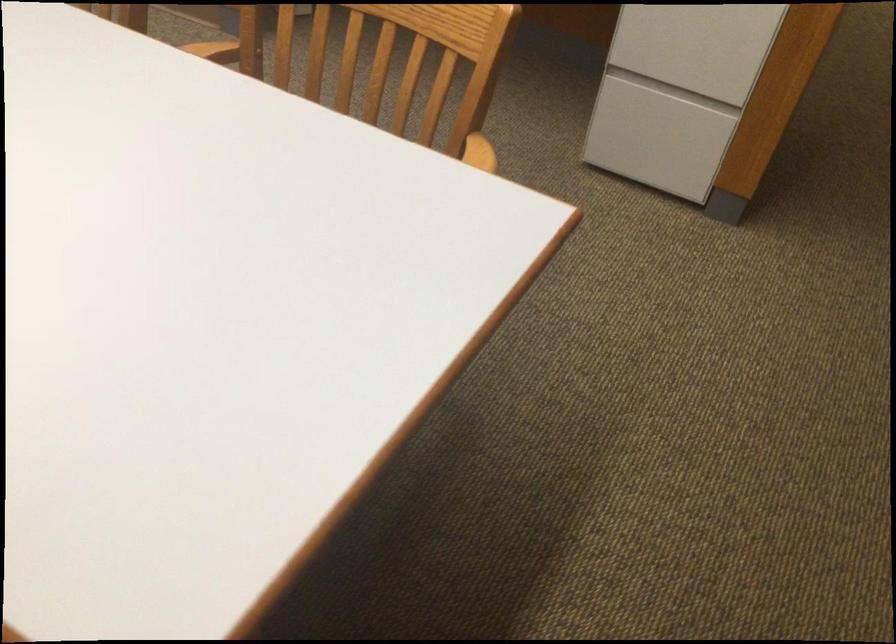
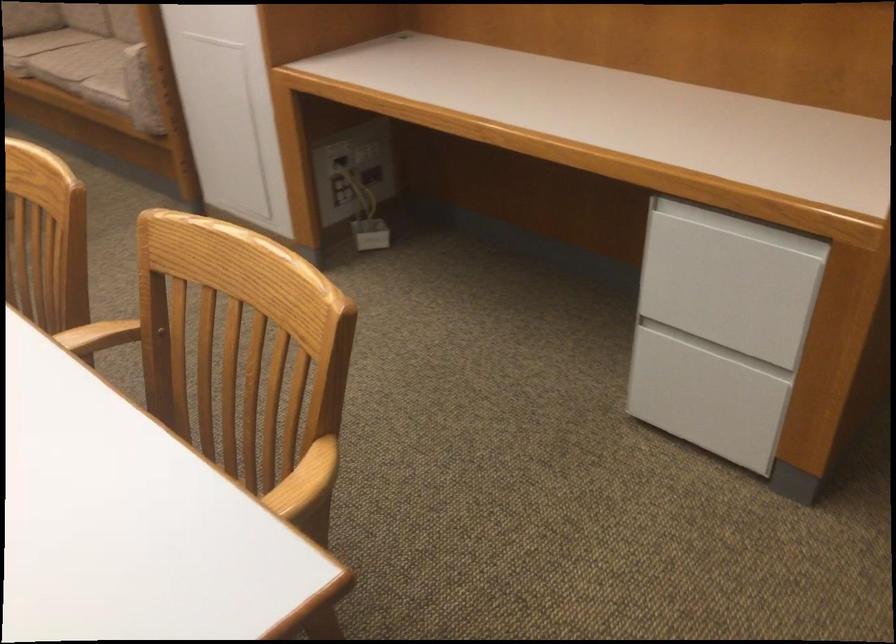
Locate, in the second image, the point that corresponds to (x=666, y=140) in the first image.

(705, 399)